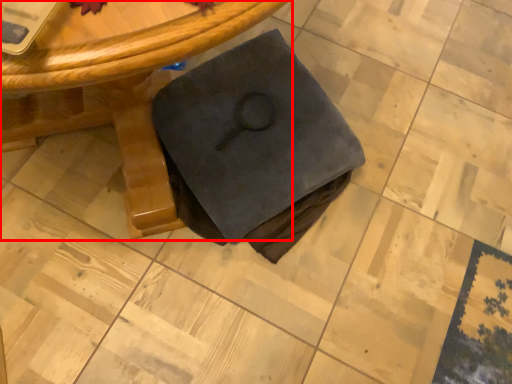
Question: Where is table (annotated by the red box) located in relation to fabric in the image?

Choices:
 (A) right
 (B) left

Answer: (B)